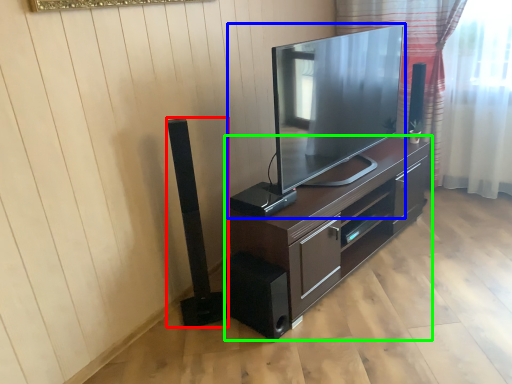
Question: Considering the real-world distances, which object is closest to speaker (highlighted by a red box)? television (highlighted by a blue box) or cabinetry (highlighted by a green box).

Choices:
 (A) television
 (B) cabinetry

Answer: (B)